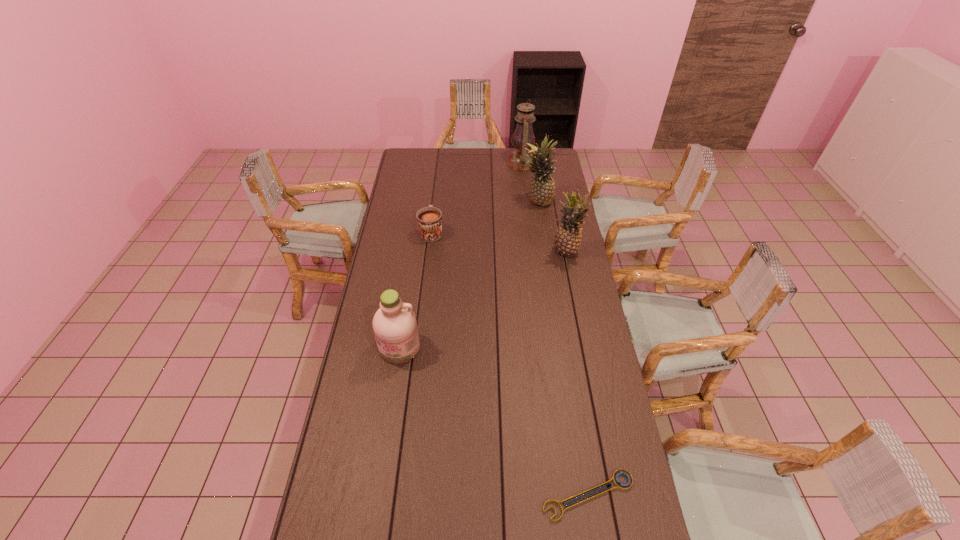
At what (x,y) coordinates should I click in order to perform the action: click on vacant area between the farther pineapple and the cleansing agent. Please return your answer as a coordinate pair (x, y). This screenshot has height=540, width=960. Looking at the image, I should click on (468, 275).

Where is `free space between the farthest object and the nearer pineapple`? free space between the farthest object and the nearer pineapple is located at coordinates (543, 208).

Image resolution: width=960 pixels, height=540 pixels. Identify the location of free space between the nearer pineapple and the mug. (498, 242).

Identify which object is the fourth nearest to the second nearest object. Please provide its 2D coordinates. Your answer should be formatted as a tuple, i.e. [(x, y)], where the tuple contains the x and y coordinates of a point satisfying the conditions above.

[(542, 187)]

Identify which object is the fourth nearest to the mug. Please provide its 2D coordinates. Your answer should be formatted as a tuple, i.e. [(x, y)], where the tuple contains the x and y coordinates of a point satisfying the conditions above.

[(518, 160)]

Identify the location of free space that satisfies the following two spatial constraints: 1. on the front side of the farther pineapple; 2. on the left side of the nearer pineapple. (545, 253).

Identify the location of free location that satisfies the following two spatial constraints: 1. on the front label of the wrench; 2. on the left side of the second nearest object. (377, 495).

This screenshot has width=960, height=540. Identify the location of free region that satisfies the following two spatial constraints: 1. on the front label of the cleansing agent; 2. on the right side of the shortest object. 377,495.

In order to click on blank space that satisfies the following two spatial constraints: 1. on the front side of the farthest object; 2. on the left side of the nearer pineapple in this screenshot , I will do `click(533, 253)`.